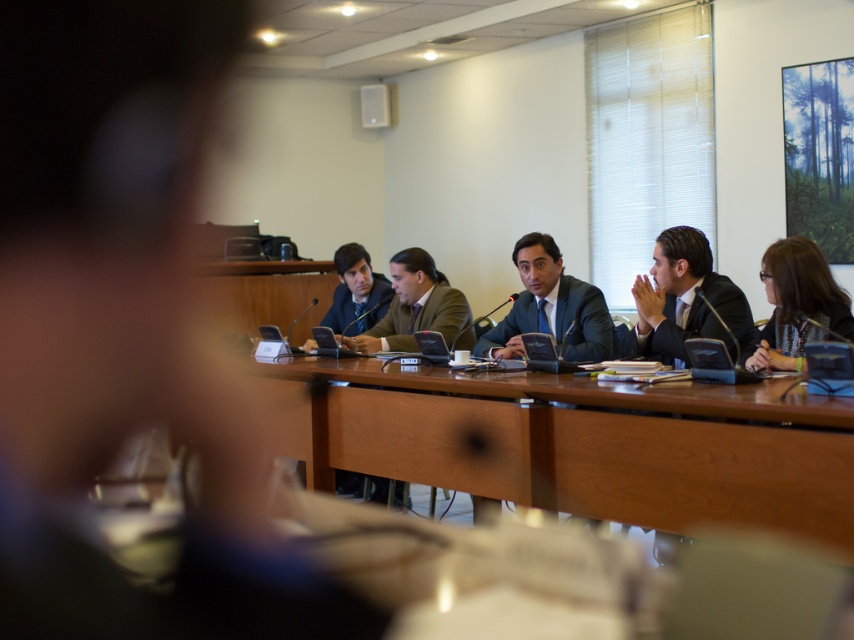
Question: Which object appears closest to the camera in this image?

Choices:
 (A) patterned fabric jacket at lower right
 (B) matte black suit at center
 (C) brown wood table at center

Answer: (C)

Question: Can you confirm if brown wood table at center is positioned to the right of patterned fabric jacket at lower right?

Choices:
 (A) no
 (B) yes

Answer: (A)

Question: Is brown wood table at center further to the viewer compared to patterned fabric jacket at lower right?

Choices:
 (A) no
 (B) yes

Answer: (A)

Question: Which of the following is the closest to the observer?

Choices:
 (A) matte black suit at center
 (B) patterned fabric jacket at lower right
 (C) matte black suit at right

Answer: (B)

Question: Which point is closer to the camera?

Choices:
 (A) (749, 364)
 (B) (659, 340)
 (C) (837, 440)
 (D) (354, 316)

Answer: (C)

Question: Observing the image, what is the correct spatial positioning of brown wood table at center in reference to patterned fabric jacket at lower right?

Choices:
 (A) above
 (B) below

Answer: (B)